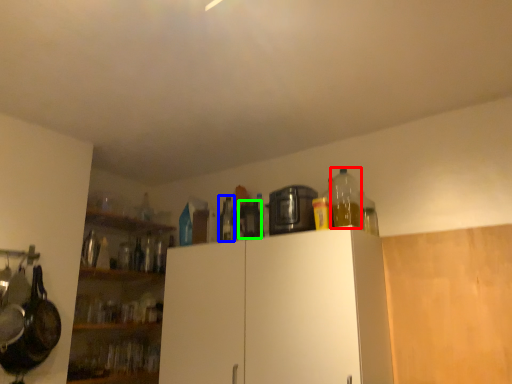
Question: Considering the real-world distances, which object is farthest from bottle (highlighted by a red box)? bottle (highlighted by a blue box) or appliance (highlighted by a green box)?

Choices:
 (A) bottle
 (B) appliance

Answer: (A)